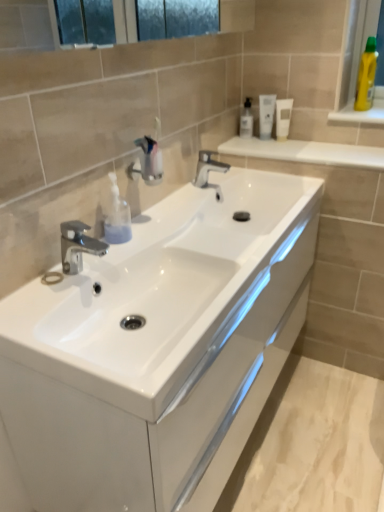
Image resolution: width=384 pixels, height=512 pixels. I want to click on free space in front of clear plastic mouthwash at upper center, which appears as the first mouthwash when viewed from the left, so click(259, 148).